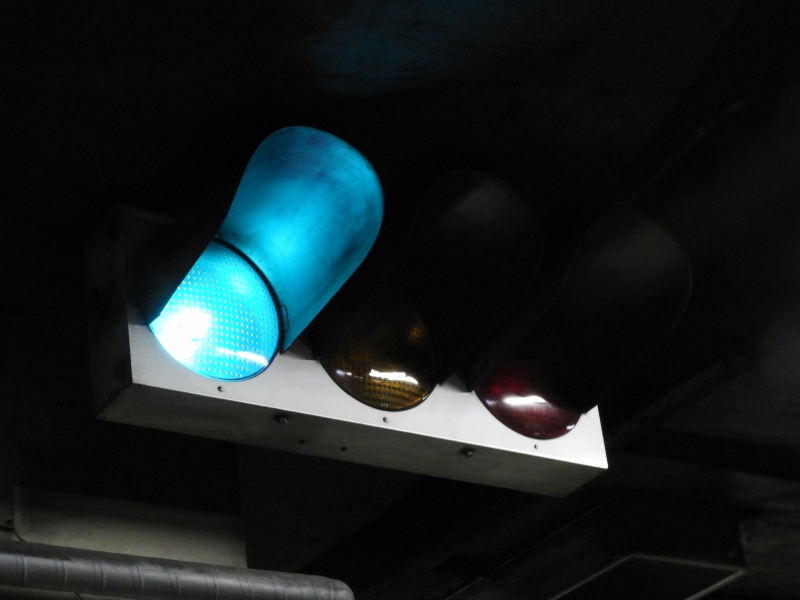
At what (x,y) coordinates should I click in order to perform the action: click on box. Please return your answer as a coordinate pair (x, y). Looking at the image, I should click on (446, 422).